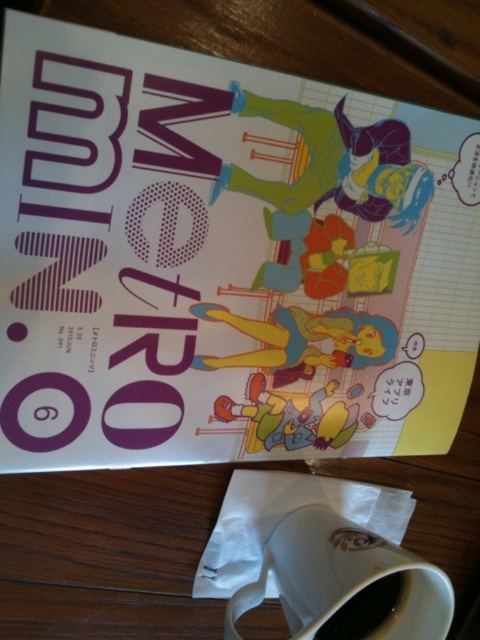
You are designing a display stand for the matte purple comic book at center and the white ceramic mug at lower center. The stand has two shelves, one above the other. Which object should be placed on the upper shelf to ensure the comic book is visible above the mug?

The matte purple comic book at center is taller than the white ceramic mug at lower center, so placing the comic book on the upper shelf and the mug on the lower shelf will ensure the comic book remains visible above the mug.

You are designing a digital layout for the magazine cover and need to place a new element at coordinates point A. The current layout has the matte purple comic book at center at point B. Which object is closer to point A if point A is at coordinates point B?

The matte purple comic book at center is located at point B, so it is exactly at point A. Therefore, it is the closest object to point A.

You are designing a layout for a magazine cover and want to place a new element at point (224, 259). According to the existing layout, what object is already present at that location?

The point (224, 259) corresponds to the matte purple comic book at center.